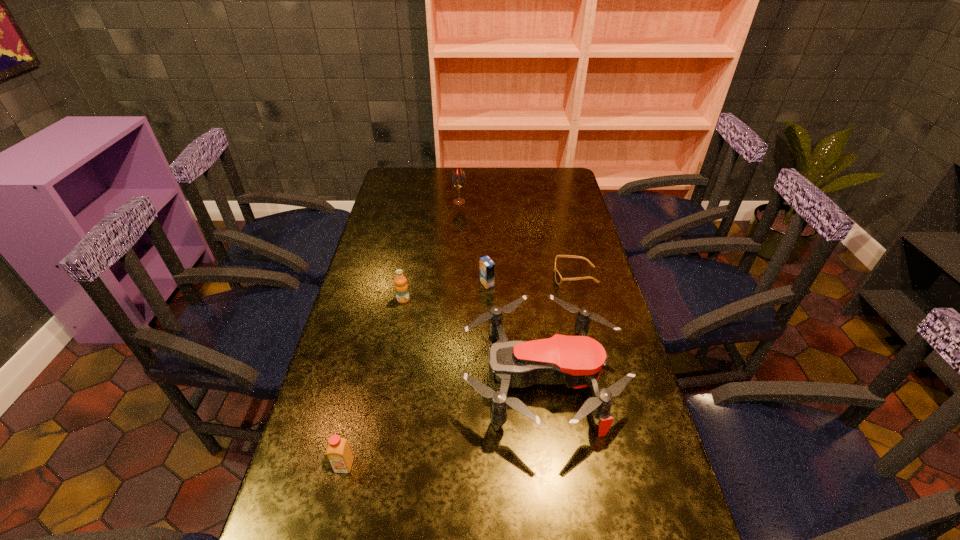
Where is `wineglass`? This screenshot has width=960, height=540. wineglass is located at coordinates (458, 179).

Locate an element on the screen. This screenshot has height=540, width=960. the farthest object is located at coordinates (458, 179).

At what (x,y) coordinates should I click in order to perform the action: click on drone. Please return your answer as a coordinate pair (x, y). Looking at the image, I should click on (578, 361).

In order to click on the second farthest orange_juice in this screenshot , I will do `click(401, 287)`.

This screenshot has width=960, height=540. What are the coordinates of `the second orange_juice from right to left` in the screenshot? It's located at (401, 287).

Locate an element on the screen. This screenshot has width=960, height=540. the nearest object is located at coordinates (338, 451).

At what (x,y) coordinates should I click in order to perform the action: click on the nearest orange_juice. Please return your answer as a coordinate pair (x, y). The width and height of the screenshot is (960, 540). Looking at the image, I should click on (338, 451).

I want to click on the fifth tallest object, so click(x=487, y=267).

The image size is (960, 540). What are the coordinates of `the rightmost orange_juice` in the screenshot? It's located at (487, 267).

Locate an element on the screen. This screenshot has width=960, height=540. sunglasses is located at coordinates (558, 278).